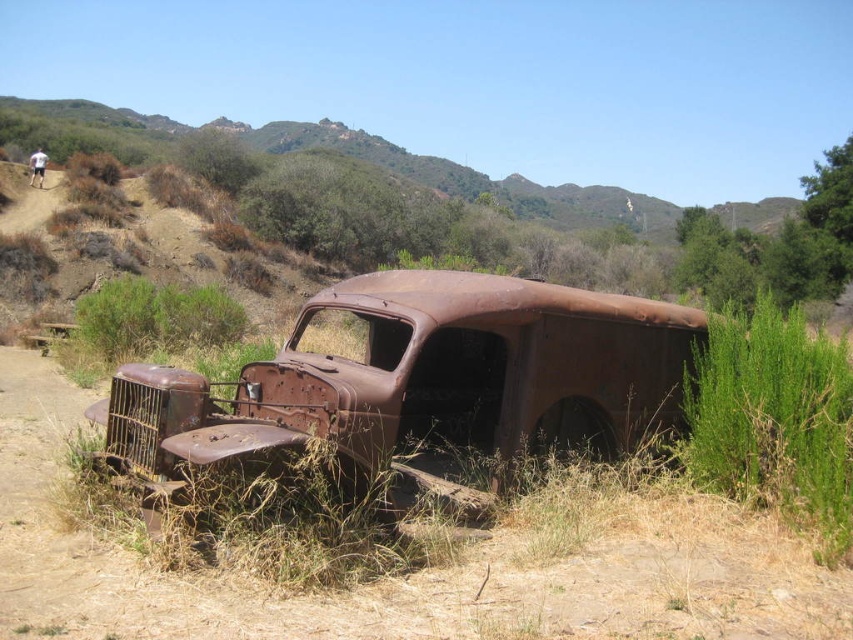
You are a photographer trying to capture both the rusty metal truck at center and the brown rusted car at lower left in a single wide shot. Since you want both vehicles to be fully visible in the frame, which vehicle should you position closer to the camera to ensure they appear similar in size?

To make the rusty metal truck at center and the brown rusted car at lower left appear similar in size in the photo, position the rusty metal truck at center closer to the camera. Since it is thinner than the brown rusted car at lower left, bringing it nearer will help balance their apparent sizes.